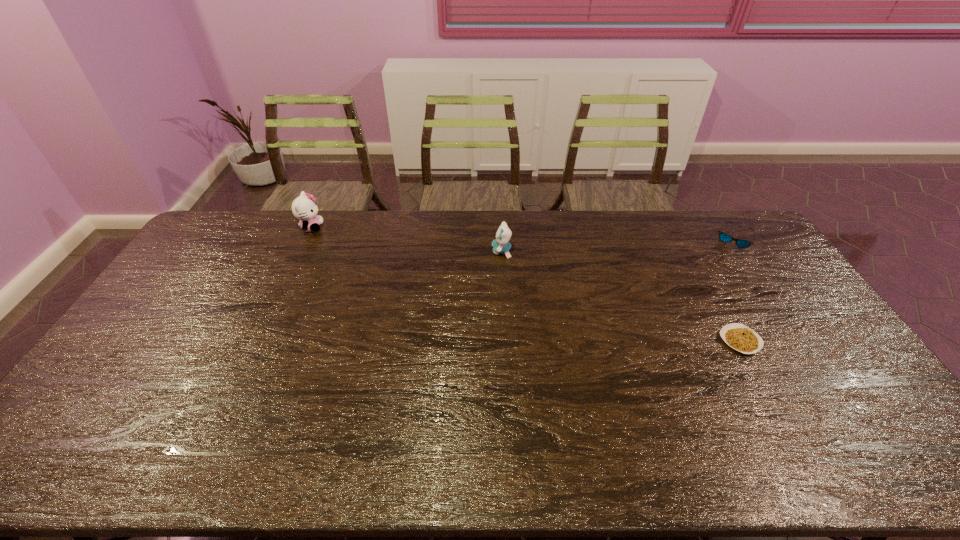
Image resolution: width=960 pixels, height=540 pixels. Identify the location of free location located on the face of the third shortest object. 433,251.

The width and height of the screenshot is (960, 540). I want to click on free space located 0.320m on the face of the third shortest object, so click(x=403, y=251).

The height and width of the screenshot is (540, 960). Identify the location of vacant region located 0.160m at the front of the second shortest object showing the lenses. (762, 280).

Identify the location of vacant space located 0.190m on the left of the legume. (656, 341).

This screenshot has width=960, height=540. Find the location of `sunglasses positioned at the far edge`. sunglasses positioned at the far edge is located at coordinates (723, 237).

You are a GUI agent. You are given a task and a screenshot of the screen. Output one action in this format:
    pyautogui.click(x=<x>, y=<y>)
    Task: Click on the object located at the right edge
    Image resolution: width=960 pixels, height=540 pixels.
    Given the screenshot: What is the action you would take?
    pyautogui.click(x=723, y=237)

Image resolution: width=960 pixels, height=540 pixels. I want to click on object at the far right corner, so click(x=723, y=237).

Find the location of a particular element. This screenshot has width=960, height=540. vacant space at the far edge is located at coordinates (671, 243).

This screenshot has height=540, width=960. What are the coordinates of `free space at the near edge` in the screenshot? It's located at (527, 446).

Image resolution: width=960 pixels, height=540 pixels. I want to click on vacant space at the left edge, so click(107, 411).